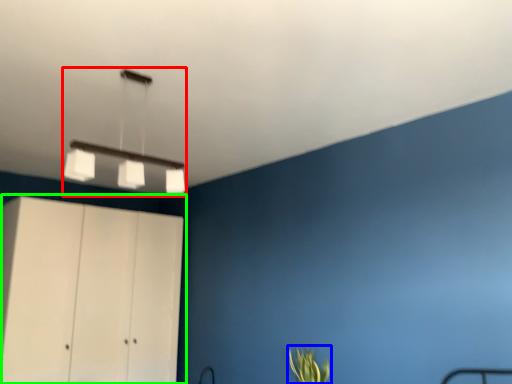
Question: Which is nearer to the lamp (highlighted by a red box)? plant (highlighted by a blue box) or cupboard (highlighted by a green box).

Choices:
 (A) plant
 (B) cupboard

Answer: (B)